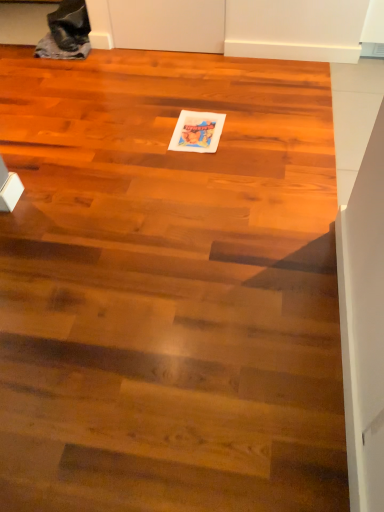
This screenshot has height=512, width=384. I want to click on vacant area on top of white paper at center (from a real-world perspective), so click(197, 128).